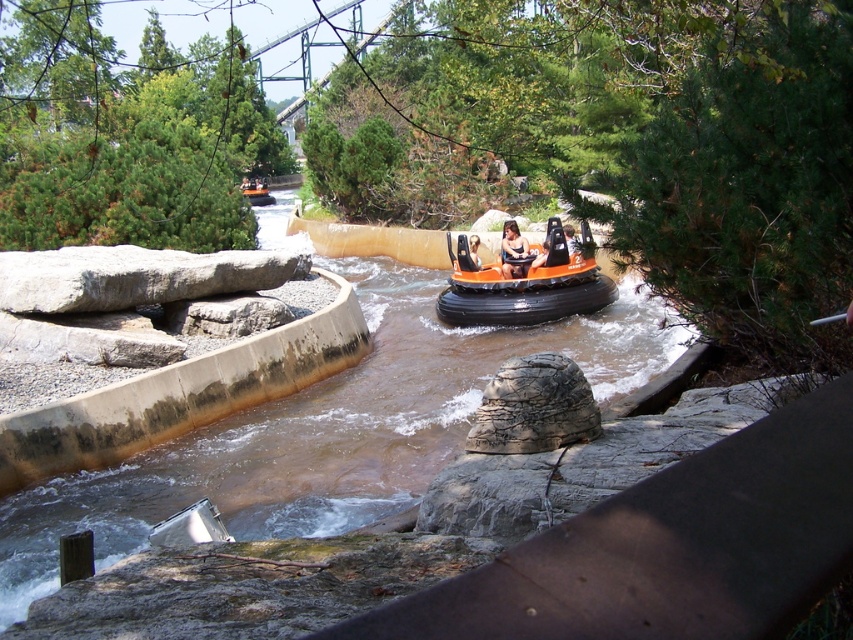
Between point (451, 321) and point (471, 244), which one is positioned behind?

Point (471, 244)

The image size is (853, 640). What do you see at coordinates (527, 285) in the screenshot? I see `orange matte bumper boat at center` at bounding box center [527, 285].

This screenshot has width=853, height=640. I want to click on orange matte bumper boat at center, so click(x=527, y=285).

Based on the photo, is matte orange raft at center closer to camera compared to smooth orange raft at center?

Yes, it is.

Which of these two, matte orange raft at center or smooth orange raft at center, stands taller?

matte orange raft at center

Describe the element at coordinates (514, 252) in the screenshot. I see `matte orange raft at center` at that location.

Find the location of a particular element. This screenshot has width=853, height=640. matte orange raft at center is located at coordinates (514, 252).

Who is lower down, orange matte bumper boat at center or matte orange raft at center?

orange matte bumper boat at center

The width and height of the screenshot is (853, 640). Find the location of `orange matte bumper boat at center`. orange matte bumper boat at center is located at coordinates (527, 285).

At what (x,y) coordinates should I click in order to perform the action: click on orange matte bumper boat at center. Please return your answer as a coordinate pair (x, y). Looking at the image, I should click on (527, 285).